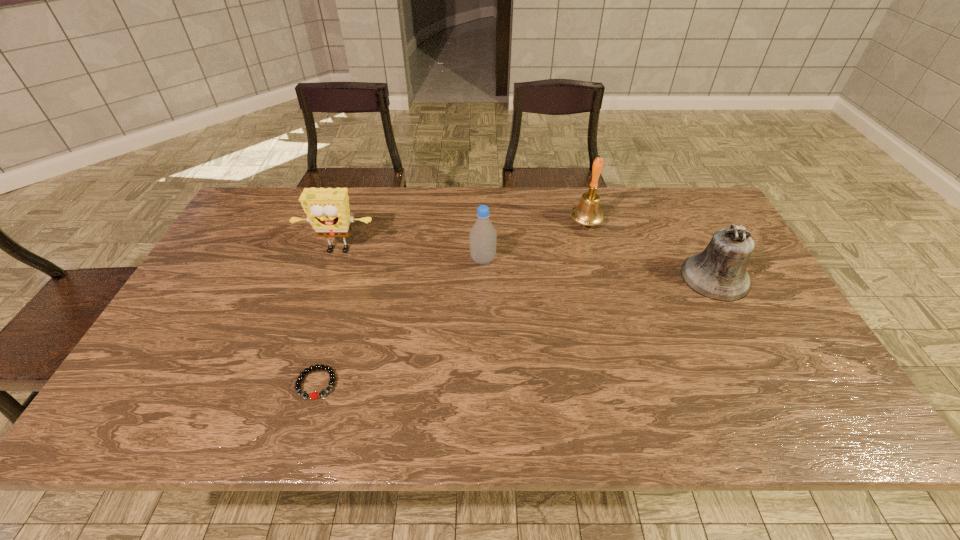
Identify the location of free point located on the front of the bottle. [x=483, y=294].

What are the coordinates of `free space located 0.190m on the back of the rightmost object` in the screenshot? It's located at (683, 217).

Identify the location of blank space located 0.350m on the right of the nearest object. The width and height of the screenshot is (960, 540). (490, 383).

Where is `object that is positioned at the far edge`? object that is positioned at the far edge is located at coordinates (587, 212).

Identify the location of object located at the near edge. Image resolution: width=960 pixels, height=540 pixels. (314, 395).

Find the location of `object that is at the right edge`. object that is at the right edge is located at coordinates (719, 273).

In the image, there is a desktop. In order to click on free space at the far edge in this screenshot , I will do `click(473, 199)`.

The height and width of the screenshot is (540, 960). In order to click on free space at the near edge in this screenshot , I will do point(502,403).

This screenshot has height=540, width=960. In the image, there is a desktop. Find the location of `free space at the left edge`. free space at the left edge is located at coordinates (257, 241).

The image size is (960, 540). I want to click on free spot at the right edge of the desktop, so click(x=718, y=310).